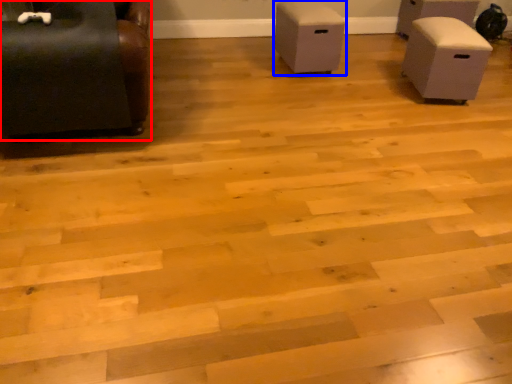
Question: Which point is closer to the camera, furniture (highlighted by a red box) or furniture (highlighted by a blue box)?

Choices:
 (A) furniture
 (B) furniture

Answer: (A)